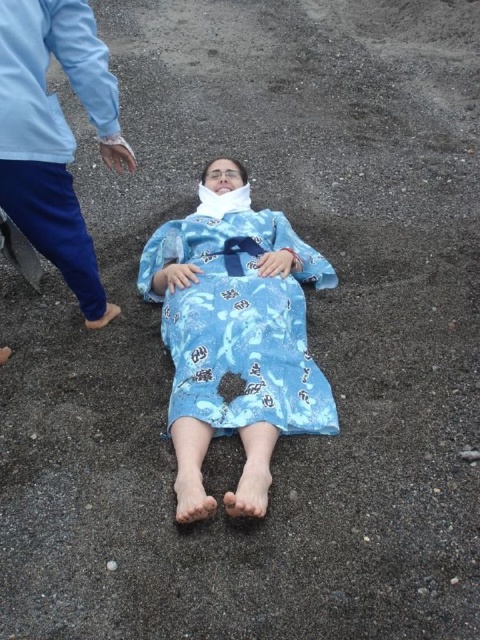
Does blue printed fabric at center appear over blue printed robe at upper left?

No, blue printed fabric at center is not above blue printed robe at upper left.

What do you see at coordinates (235, 336) in the screenshot? I see `blue printed fabric at center` at bounding box center [235, 336].

What are the coordinates of `blue printed fabric at center` in the screenshot? It's located at (235, 336).

Where is `blue printed fabric at center`? The height and width of the screenshot is (640, 480). blue printed fabric at center is located at coordinates (235, 336).